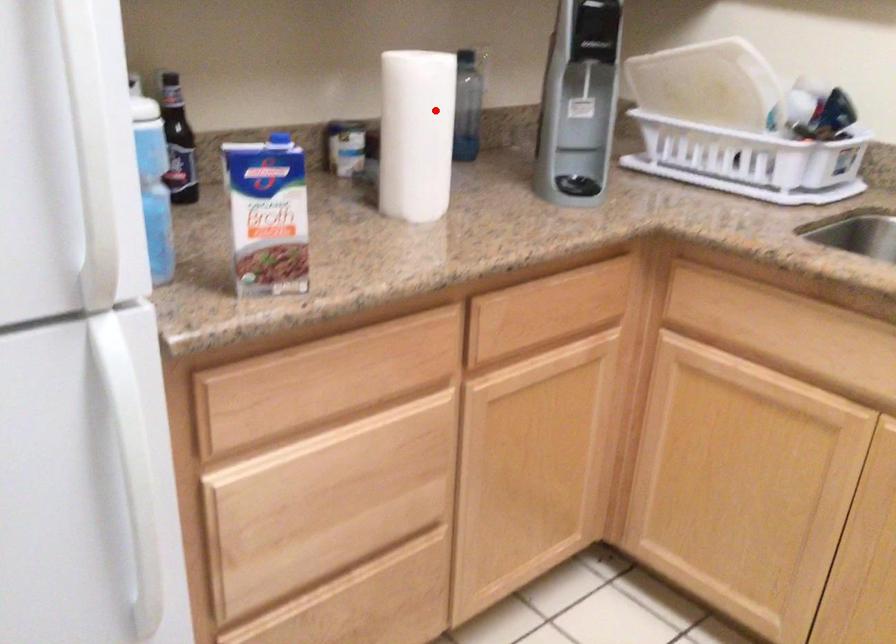
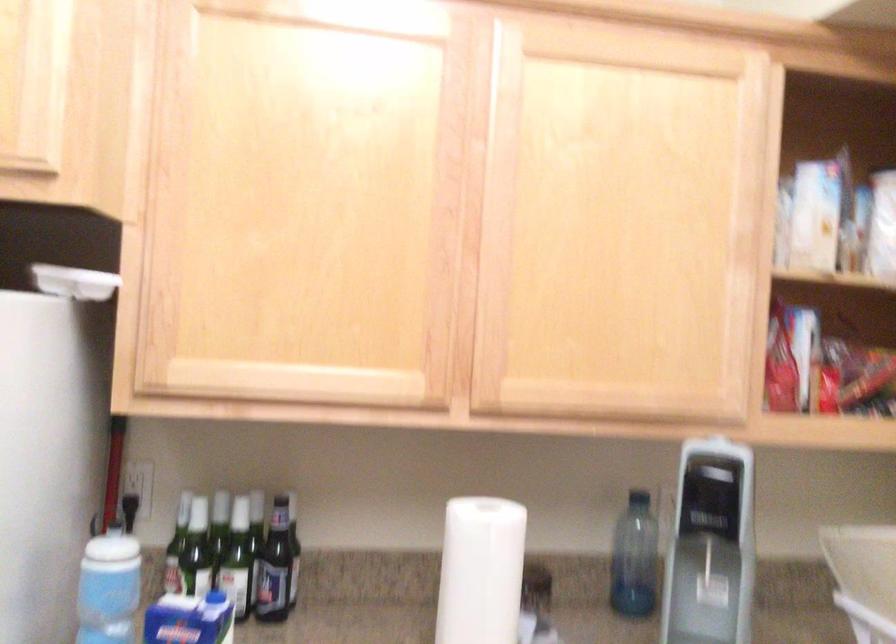
Question: A red point is marked in image1. In image2, is the corresponding 3D point closer to the camera or farther? Reply with the corresponding letter.

Choices:
 (A) The corresponding 3D point is closer.
 (B) The corresponding 3D point is farther.

Answer: (A)